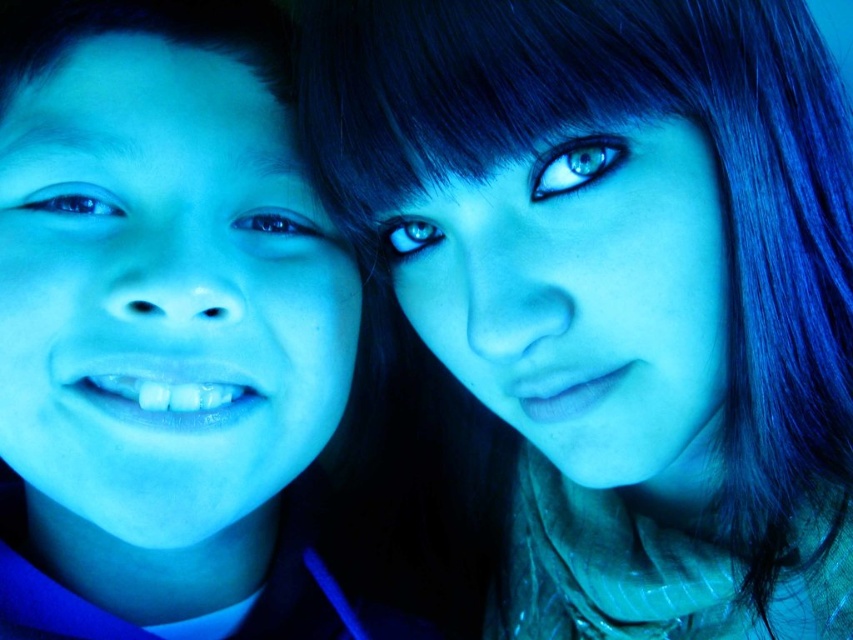
Does point (781, 460) lie behind point (44, 161)?

Yes, point (781, 460) is behind point (44, 161).

Can you confirm if blue matte hair at upper right is taller than matte blue face at left?

Yes.

Identify the location of blue matte hair at upper right. Image resolution: width=853 pixels, height=640 pixels. (619, 289).

The width and height of the screenshot is (853, 640). Find the location of `blue matte hair at upper right`. blue matte hair at upper right is located at coordinates (619, 289).